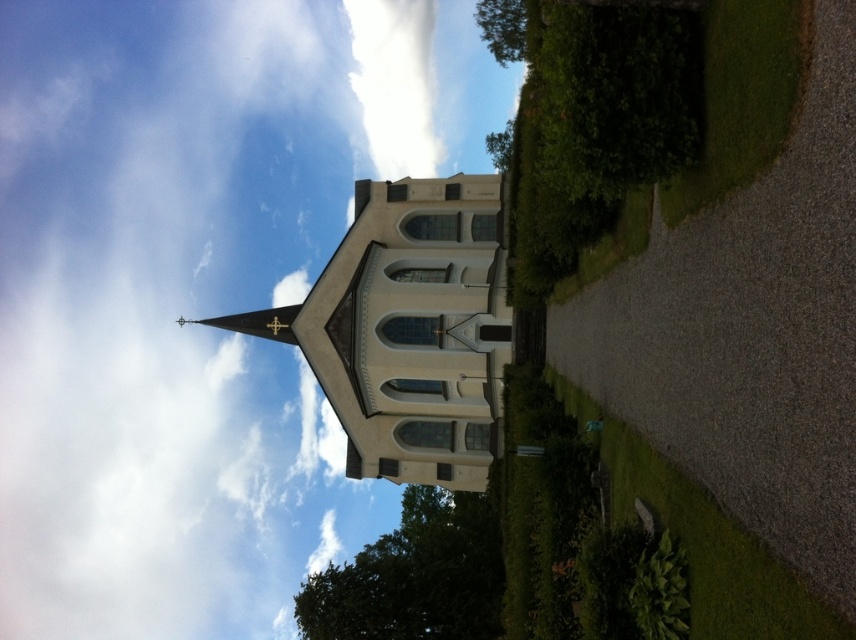
Question: Where is green leafy tree at lower center located in relation to green leafy tree at upper center in the image?

Choices:
 (A) right
 (B) left

Answer: (B)

Question: Does white smooth church steeple at center appear on the right side of green leafy tree at lower center?

Choices:
 (A) no
 (B) yes

Answer: (A)

Question: Which object is farther from the camera taking this photo?

Choices:
 (A) white smooth church steeple at center
 (B) green leafy tree at upper center
 (C) green leafy tree at lower center

Answer: (B)

Question: Which object is the closest to the green leafy tree at upper center?

Choices:
 (A) white fluffy cloud at upper left
 (B) white smooth church steeple at center
 (C) green leafy tree at lower center

Answer: (B)

Question: Estimate the real-world distances between objects in this image. Which object is closer to the green leafy tree at lower center?

Choices:
 (A) white smooth church steeple at center
 (B) white fluffy cloud at upper left
 (C) green leafy tree at upper center

Answer: (A)

Question: Considering the relative positions of green leafy tree at lower center and green leafy tree at upper center in the image provided, where is green leafy tree at lower center located with respect to green leafy tree at upper center?

Choices:
 (A) below
 (B) above

Answer: (A)